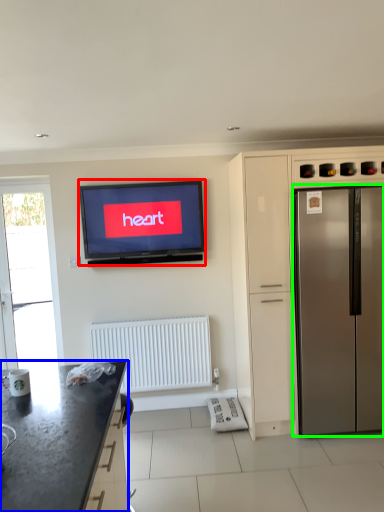
Question: Based on their relative distances, which object is nearer to television (highlighted by a red box)? Choose from countertop (highlighted by a blue box) and refrigerator (highlighted by a green box).

Choices:
 (A) countertop
 (B) refrigerator

Answer: (B)